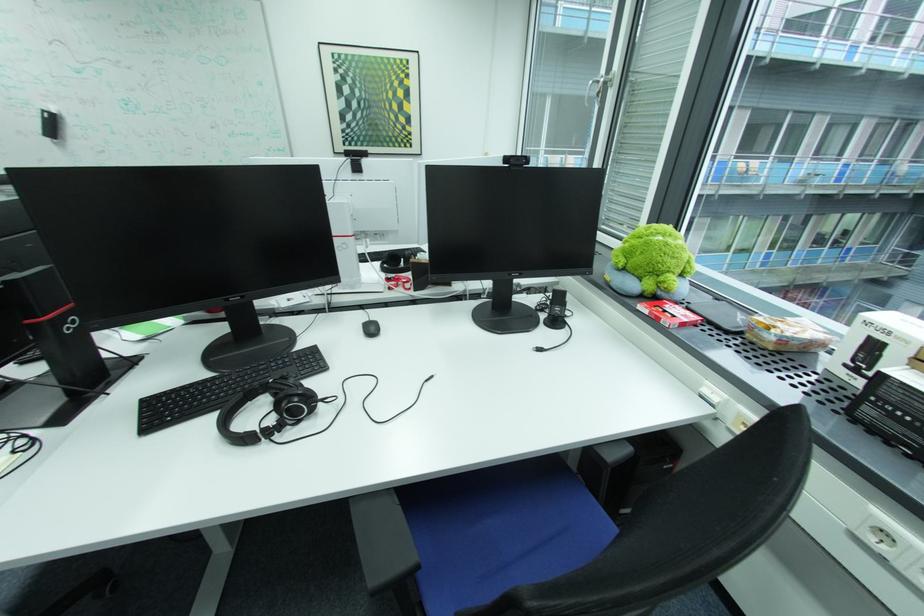
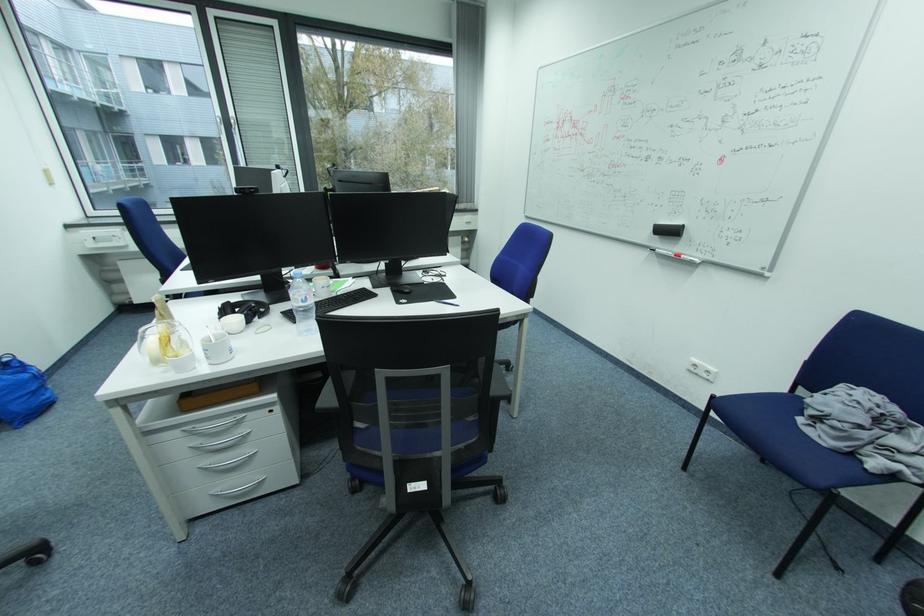
Question: I am providing you with two images of the same scene from different viewpoints. After the viewpoint changes to image2, which objects are now occluded?

Choices:
 (A) wooden roll holder
 (B) black headphones
 (C) black computer mouse
 (D) silver drawer handle

Answer: (C)